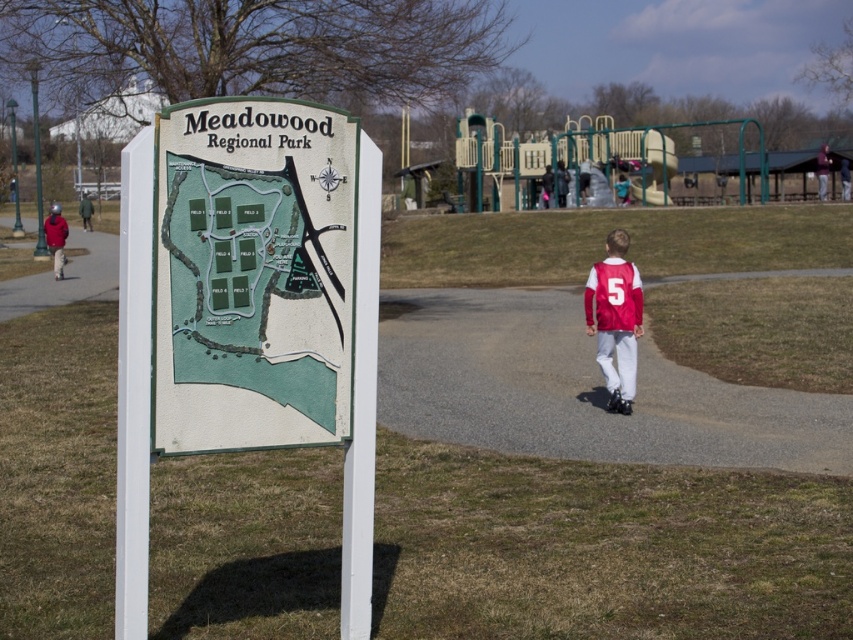
Which is more to the right, green plastic sign at center or smooth asphalt path at left?

green plastic sign at center

Describe the element at coordinates (248, 316) in the screenshot. I see `green plastic sign at center` at that location.

Who is more distant from viewer, [132,620] or [108,237]?

The point [108,237] is behind.

Locate an element on the screen. The width and height of the screenshot is (853, 640). green plastic sign at center is located at coordinates (248, 316).

Is matte red jersey at center thinner than smooth asphalt path at left?

Yes, matte red jersey at center is thinner than smooth asphalt path at left.

Who is higher up, matte red jersey at center or smooth asphalt path at left?

Positioned higher is smooth asphalt path at left.

Who is more forward, (608, 330) or (91, 288)?

Point (608, 330)

At what (x,y) coordinates should I click in order to perform the action: click on matte red jersey at center. Please return your answer as a coordinate pair (x, y). This screenshot has height=640, width=853. Looking at the image, I should click on (614, 317).

Does green plastic sign at center have a lesser height compared to matte red jersey at center?

Incorrect, green plastic sign at center's height does not fall short of matte red jersey at center's.

Does green plastic sign at center have a lesser width compared to matte red jersey at center?

No.

Who is more distant from viewer, (229, 186) or (611, 244)?

Positioned behind is point (611, 244).

At what (x,y) coordinates should I click in order to perform the action: click on green plastic sign at center. Please return your answer as a coordinate pair (x, y). The width and height of the screenshot is (853, 640). Looking at the image, I should click on (248, 316).